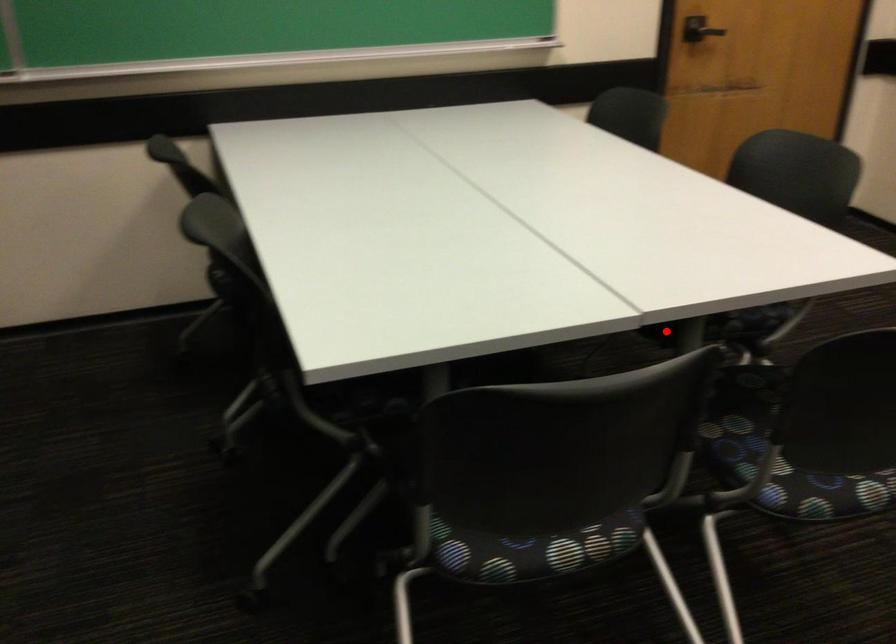
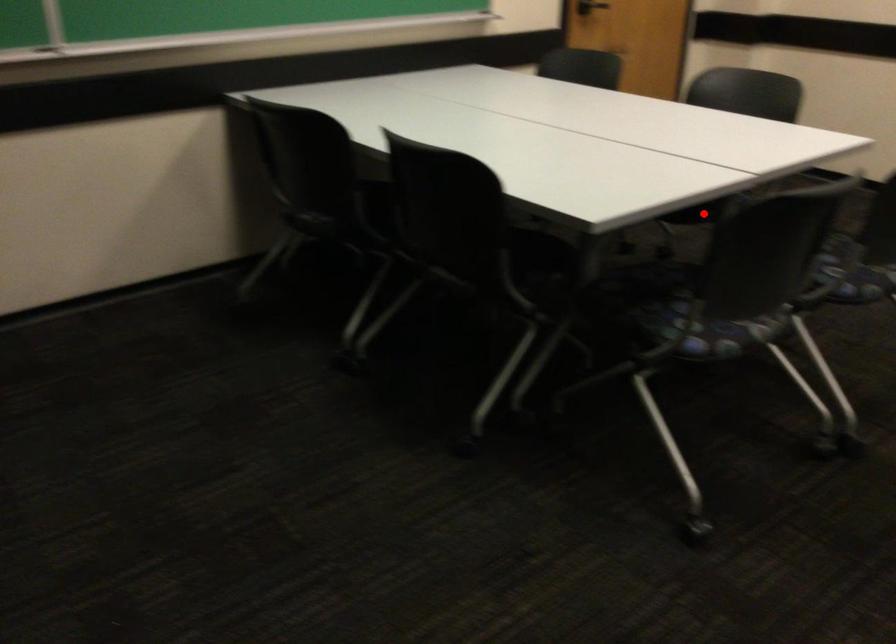
Looking at this image, I am providing you with two images of the same scene from different viewpoints. A red point is marked on the first image and another point is marked on the second image. Are the points marked in image1 and image2 representing the same 3D position?

Yes